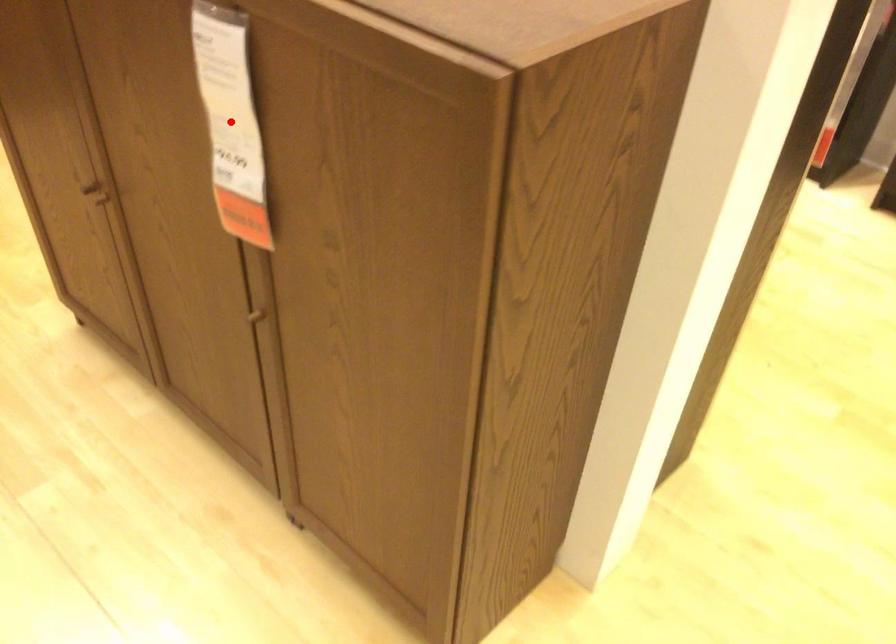
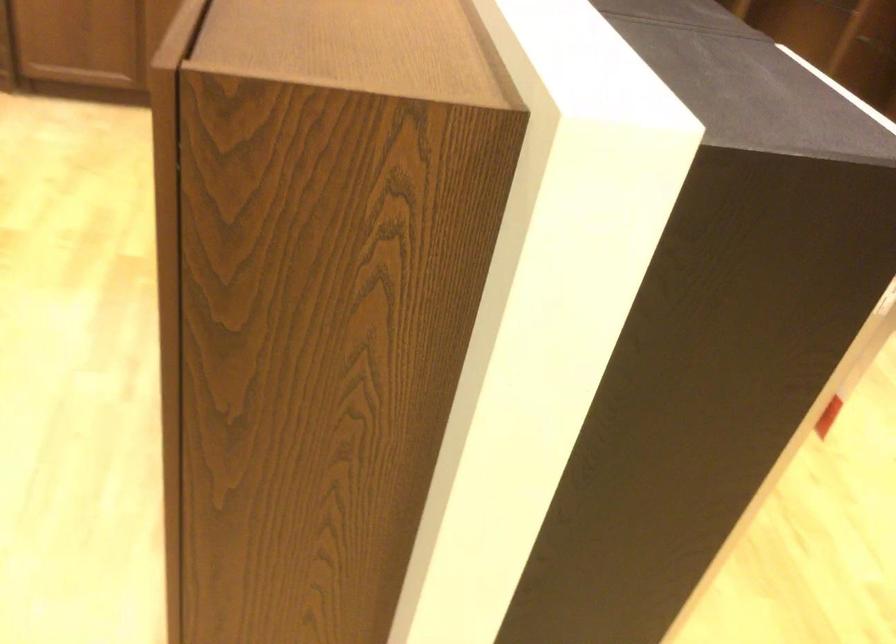
Question: I am providing you with two images of the same scene from different viewpoints. A red point is marked on the first image. Can you still see the location of the red point in image 2?

Choices:
 (A) Yes
 (B) No

Answer: (B)